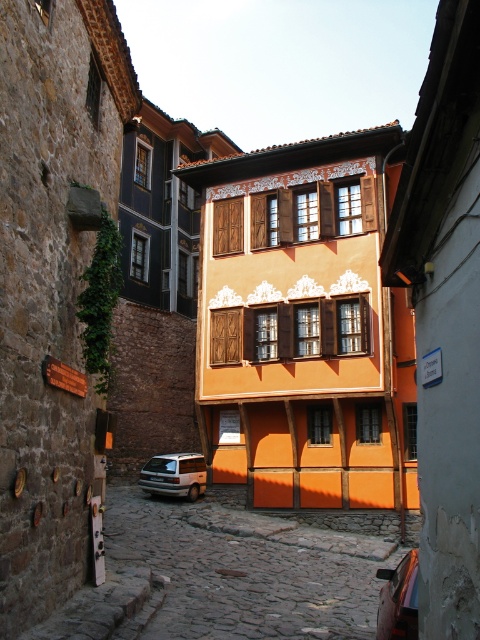
Does cobblestone street at center have a greater width compared to white matte van at lower center?

Correct, the width of cobblestone street at center exceeds that of white matte van at lower center.

The width and height of the screenshot is (480, 640). I want to click on cobblestone street at center, so (x=248, y=573).

Where is `cobblestone street at center`? cobblestone street at center is located at coordinates (248, 573).

Is cobblestone street at center thinner than shiny black car at center?

No.

Which is behind, point (393, 560) or point (411, 563)?

Positioned behind is point (393, 560).

Locate an element on the screen. This screenshot has height=640, width=480. cobblestone street at center is located at coordinates (248, 573).

Image resolution: width=480 pixels, height=640 pixels. What are the coordinates of `cobblestone street at center` in the screenshot? It's located at (248, 573).

Is shiny black car at center behind white matte van at lower center?

No.

Can you confirm if shiny black car at center is positioned above white matte van at lower center?

Yes.

This screenshot has height=640, width=480. I want to click on shiny black car at center, so click(398, 600).

Locate an element on the screen. The image size is (480, 640). shiny black car at center is located at coordinates (398, 600).